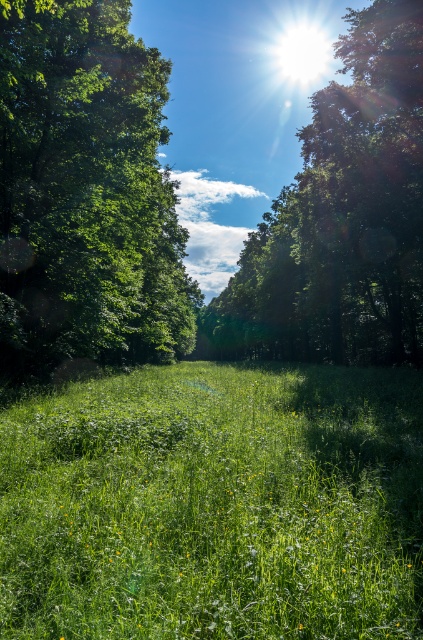
Question: Can you confirm if green leafy tree at left is smaller than green leafy tree at upper center?

Choices:
 (A) yes
 (B) no

Answer: (A)

Question: Which of the following is the closest to the observer?

Choices:
 (A) (27, 16)
 (B) (398, 182)
 (C) (60, 515)

Answer: (C)

Question: Which point is farther to the camera?

Choices:
 (A) green leafy tree at upper center
 (B) green grassy field at center
 (C) green leafy tree at left

Answer: (A)

Question: Can you confirm if green leafy tree at left is positioned above green leafy tree at upper center?

Choices:
 (A) yes
 (B) no

Answer: (B)

Question: Is green grassy field at center wider than green leafy tree at upper center?

Choices:
 (A) yes
 (B) no

Answer: (B)

Question: Based on their relative distances, which object is nearer to the green leafy tree at upper center?

Choices:
 (A) green leafy tree at left
 (B) green grassy field at center

Answer: (A)